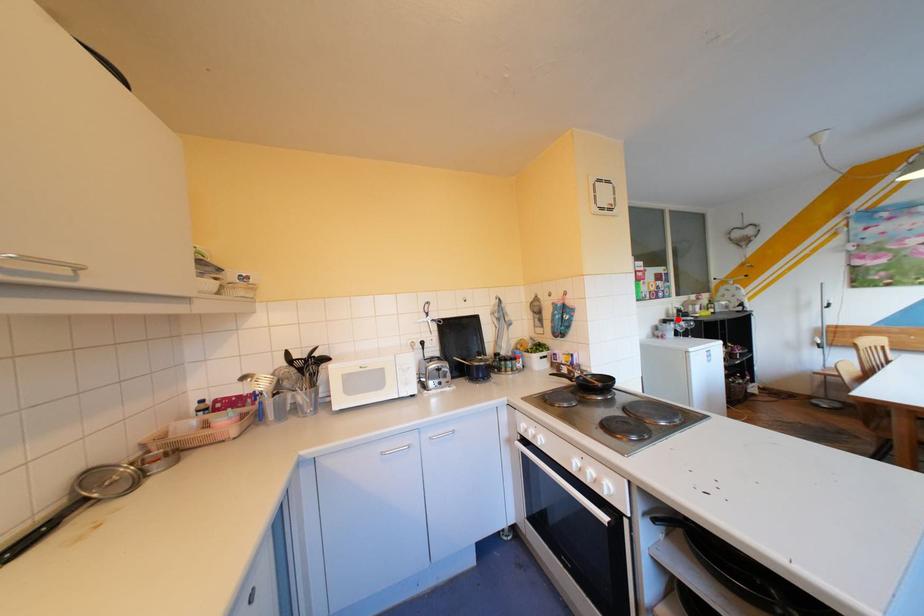
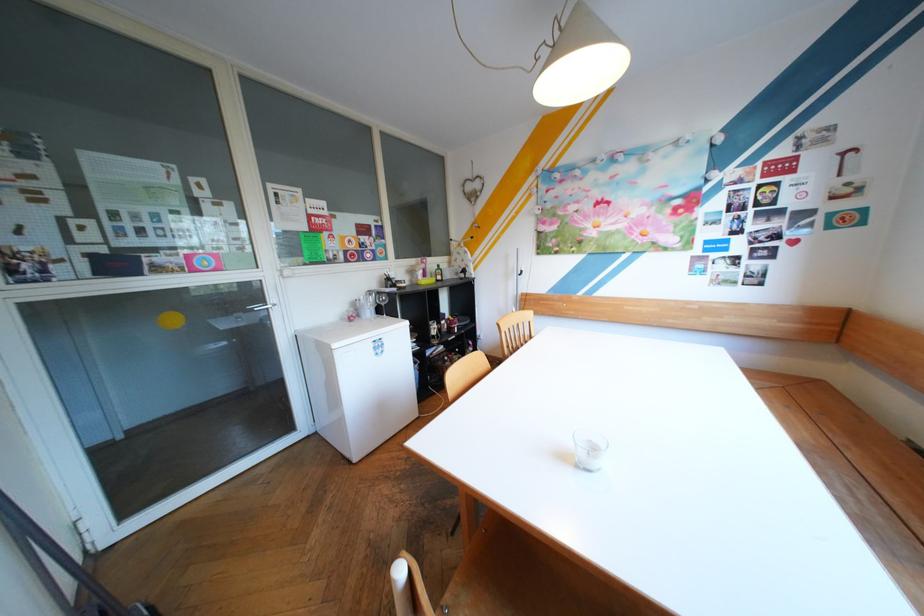
The point at the highlighted location is marked in the first image. Where is the corresponding point in the second image?

(383, 292)